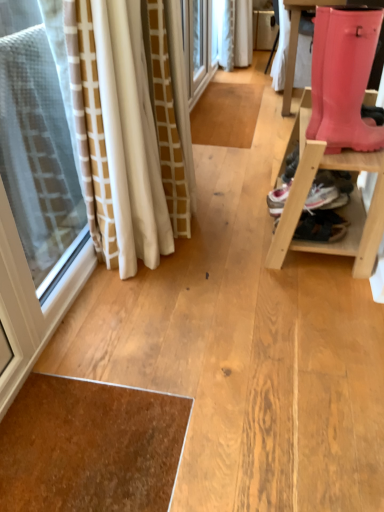
Question: Can you confirm if pink rubber boot at right is positioned to the right of pink rubber boot at right?

Choices:
 (A) no
 (B) yes

Answer: (A)

Question: Considering the relative sizes of pink rubber boot at right and pink rubber boot at right in the image provided, is pink rubber boot at right taller than pink rubber boot at right?

Choices:
 (A) yes
 (B) no

Answer: (B)

Question: From the image's perspective, does pink rubber boot at right appear lower than pink rubber boot at right?

Choices:
 (A) yes
 (B) no

Answer: (B)

Question: Is pink rubber boot at right wider than pink rubber boot at right?

Choices:
 (A) no
 (B) yes

Answer: (A)

Question: Is pink rubber boot at right at the left side of pink rubber boot at right?

Choices:
 (A) no
 (B) yes

Answer: (B)

Question: Is pink rubber boot at right bigger than pink rubber boot at right?

Choices:
 (A) no
 (B) yes

Answer: (A)

Question: Can we say pink rubber boot at right lies outside pink rubber boot at right?

Choices:
 (A) no
 (B) yes

Answer: (B)

Question: Is pink rubber boot at right shorter than pink rubber boot at right?

Choices:
 (A) no
 (B) yes

Answer: (A)

Question: Does pink rubber boot at right appear on the right side of pink rubber boot at right?

Choices:
 (A) no
 (B) yes

Answer: (B)

Question: Can you confirm if pink rubber boot at right is positioned to the left of pink rubber boot at right?

Choices:
 (A) no
 (B) yes

Answer: (A)

Question: Is pink rubber boot at right aimed at pink rubber boot at right?

Choices:
 (A) yes
 (B) no

Answer: (B)

Question: From a real-world perspective, does pink rubber boot at right stand above pink rubber boot at right?

Choices:
 (A) no
 (B) yes

Answer: (A)

Question: Visually, is pink rubber boot at right positioned to the left or to the right of pink rubber boot at right?

Choices:
 (A) right
 (B) left

Answer: (A)